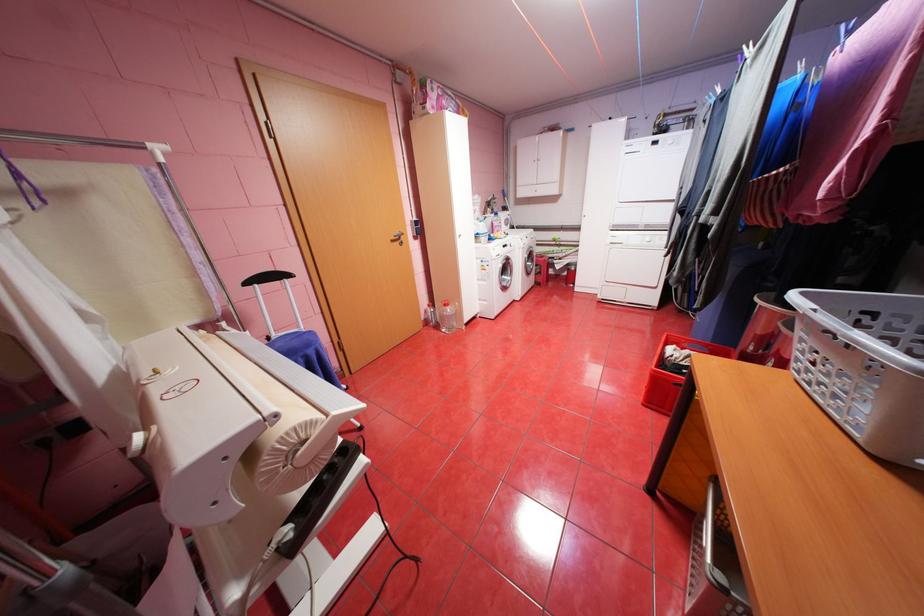
Find the location of a particular element. The height and width of the screenshot is (616, 924). washing machine knob is located at coordinates (493, 277).